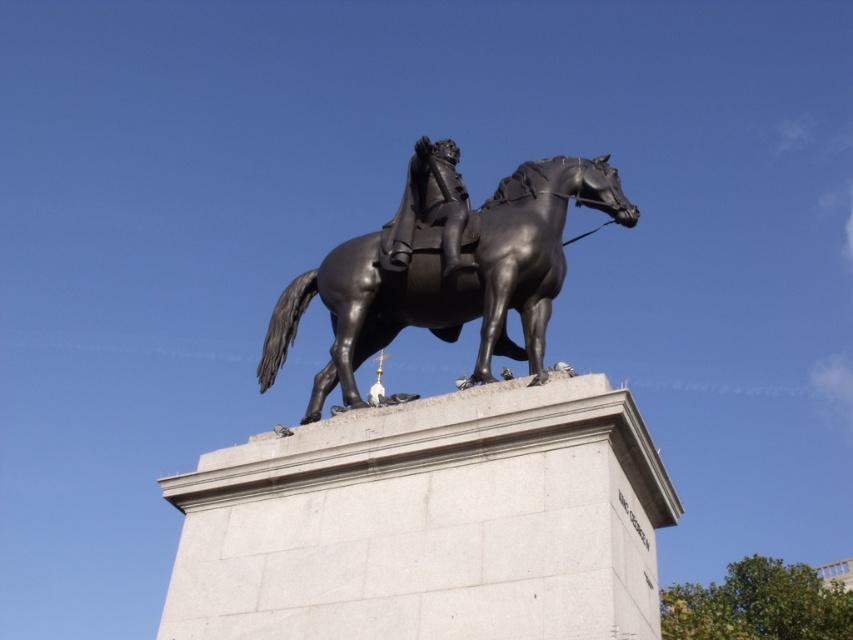
Based on the photo, can you confirm if bronze statue at center is smaller than polished bronze figure at center?

Incorrect, bronze statue at center is not smaller in size than polished bronze figure at center.

Is bronze statue at center to the right of polished bronze figure at center from the viewer's perspective?

Correct, you'll find bronze statue at center to the right of polished bronze figure at center.

Find the location of a particular element. The height and width of the screenshot is (640, 853). bronze statue at center is located at coordinates (433, 461).

Is bronze statue at center positioned at the back of polished bronze horse at center?

No, it is not.

Does bronze statue at center appear over polished bronze horse at center?

Incorrect, bronze statue at center is not positioned above polished bronze horse at center.

Between point (561, 428) and point (543, 198), which one is positioned in front?

Point (561, 428) is in front.

You are a GUI agent. You are given a task and a screenshot of the screen. Output one action in this format:
    pyautogui.click(x=<x>, y=<y>)
    Task: Click on the bronze statue at center
    This screenshot has height=640, width=853.
    Given the screenshot: What is the action you would take?
    pyautogui.click(x=433, y=461)

Between polished bronze horse at center and polished bronze figure at center, which one is positioned lower?

Positioned lower is polished bronze horse at center.

Describe the element at coordinates (450, 280) in the screenshot. I see `polished bronze horse at center` at that location.

You are a GUI agent. You are given a task and a screenshot of the screen. Output one action in this format:
    pyautogui.click(x=<x>, y=<y>)
    Task: Click on the polished bronze horse at center
    
    Given the screenshot: What is the action you would take?
    pyautogui.click(x=450, y=280)